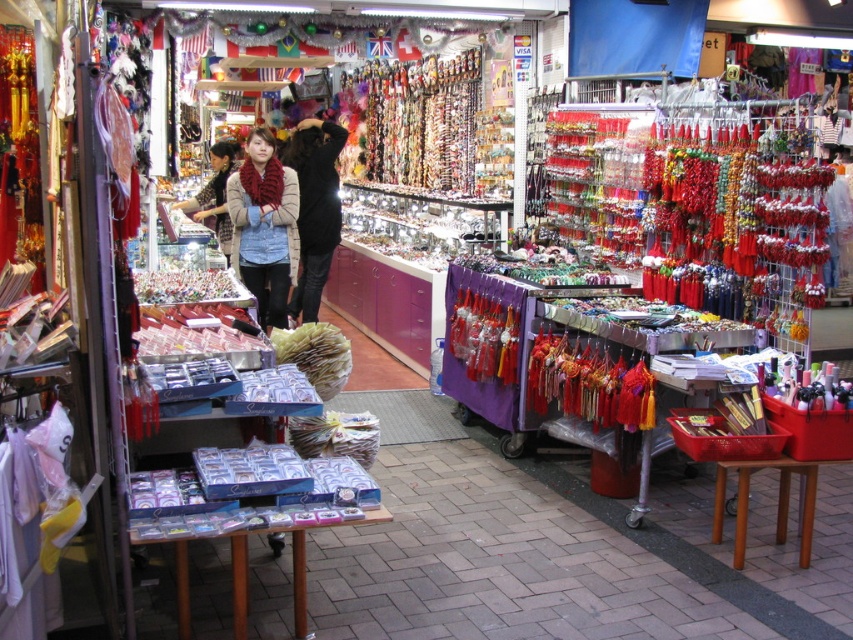
You are a customer at the market stall and want to pick up both the black matte jacket at center and the velvet scarf at center. How far apart are these two items from each other?

The black matte jacket at center and the velvet scarf at center are 39.22 inches apart from each other.

You are a customer at the market stall and want to know which item takes up more horizontal space between the black matte jacket at center and the velvet scarf at center. Which one is wider?

The velvet scarf at center is wider than the black matte jacket at center.

You are a delivery robot with a 24 inch wide package. You need to move from the knitted red scarf at center to the black matte jacket at center. Can you fit through the space between them?

The distance between the knitted red scarf at center and the black matte jacket at center is 31.15 inches. Since your package is 24 inches wide, you can fit through the space as 31.15 inches is wider than 24 inches.